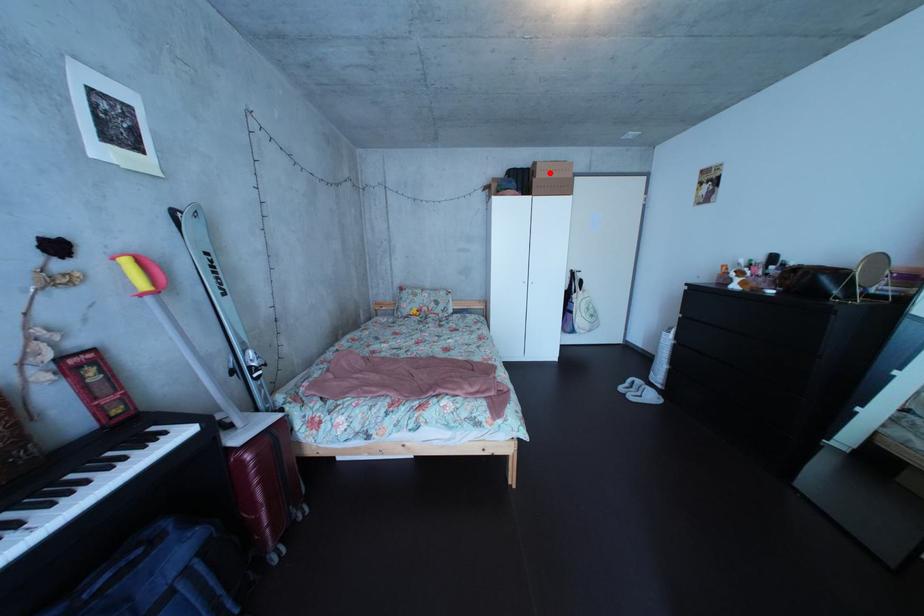
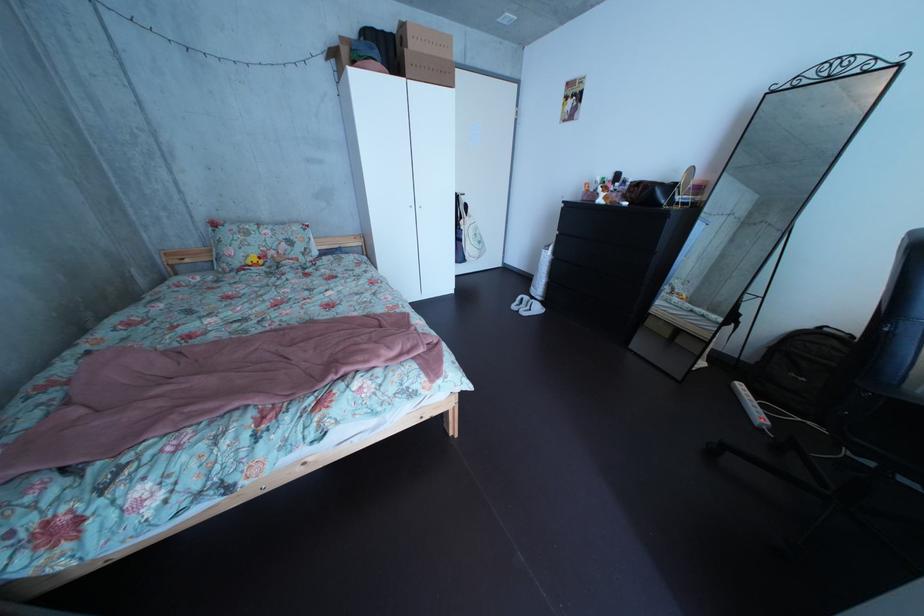
Question: I am providing you with two images of the same scene from different viewpoints. Given a red point in image1, look at the same physical point in image2. Is it:

Choices:
 (A) Closer to the viewpoint
 (B) Farther from the viewpoint

Answer: (B)